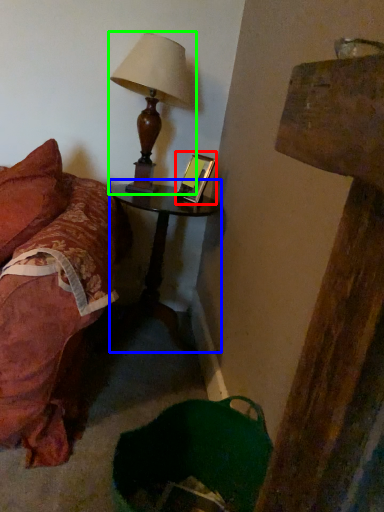
Question: Considering the real-world distances, which object is closest to picture frame (highlighted by a red box)? nightstand (highlighted by a blue box) or lamp (highlighted by a green box).

Choices:
 (A) nightstand
 (B) lamp

Answer: (B)